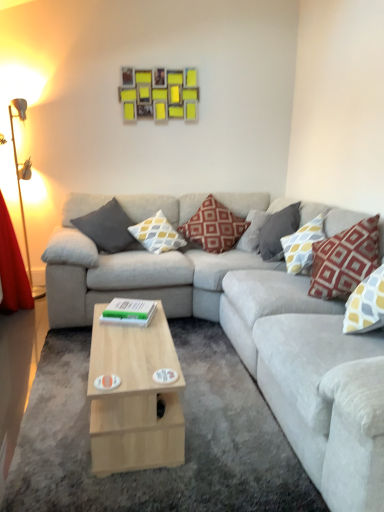
Find the location of `unoccupied area in front of light wood/wooden coffee table at center`. unoccupied area in front of light wood/wooden coffee table at center is located at coordinates (127, 482).